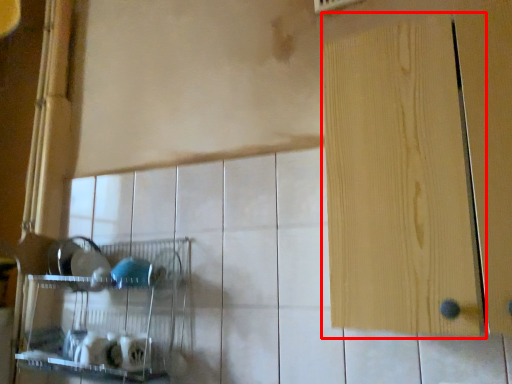
Question: Observing the image, what is the correct spatial positioning of door (annotated by the red box) in reference to shelf?

Choices:
 (A) left
 (B) right

Answer: (B)